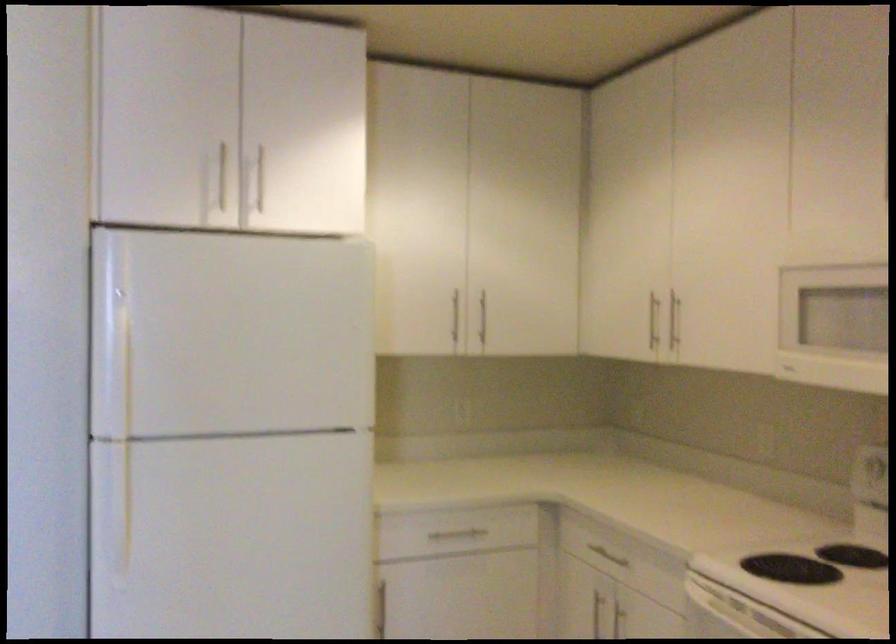
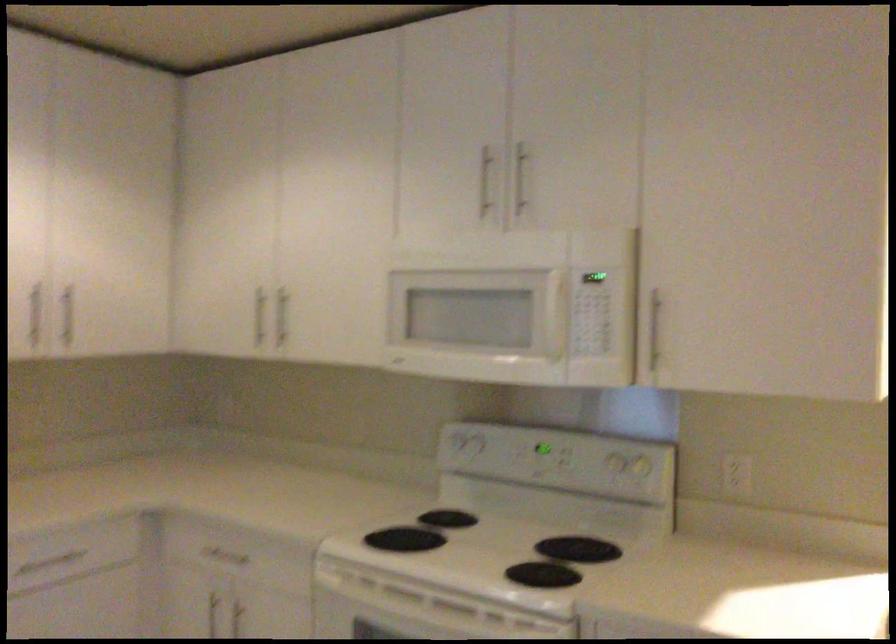
Find the pixel in the second image that matches [479,319] in the first image.

(66, 316)